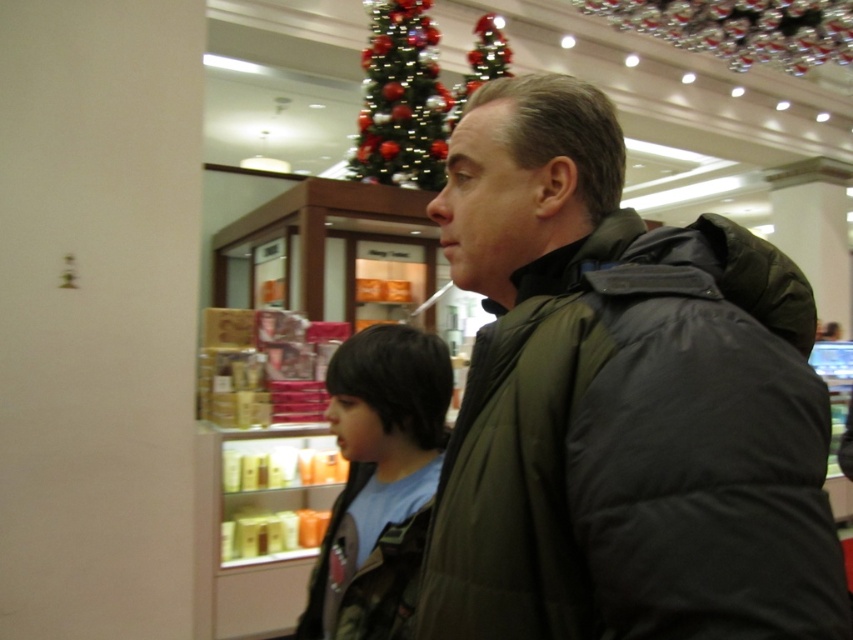
Question: Estimate the real-world distances between objects in this image. Which object is closer to the shiny metallic tree at upper center?

Choices:
 (A) dark green puffer jacket at center
 (B) camouflage jacket at center

Answer: (B)

Question: Does camouflage jacket at center appear on the right side of shiny metallic tree at upper center?

Choices:
 (A) no
 (B) yes

Answer: (B)

Question: Does dark green puffer jacket at center have a larger size compared to camouflage jacket at center?

Choices:
 (A) yes
 (B) no

Answer: (A)

Question: Which of these objects is positioned closest to the dark green puffer jacket at center?

Choices:
 (A) camouflage jacket at center
 (B) shiny metallic tree at upper center

Answer: (A)

Question: Can you confirm if dark green puffer jacket at center is positioned below shiny metallic tree at upper center?

Choices:
 (A) no
 (B) yes

Answer: (B)

Question: Among these objects, which one is nearest to the camera?

Choices:
 (A) dark green puffer jacket at center
 (B) camouflage jacket at center

Answer: (A)